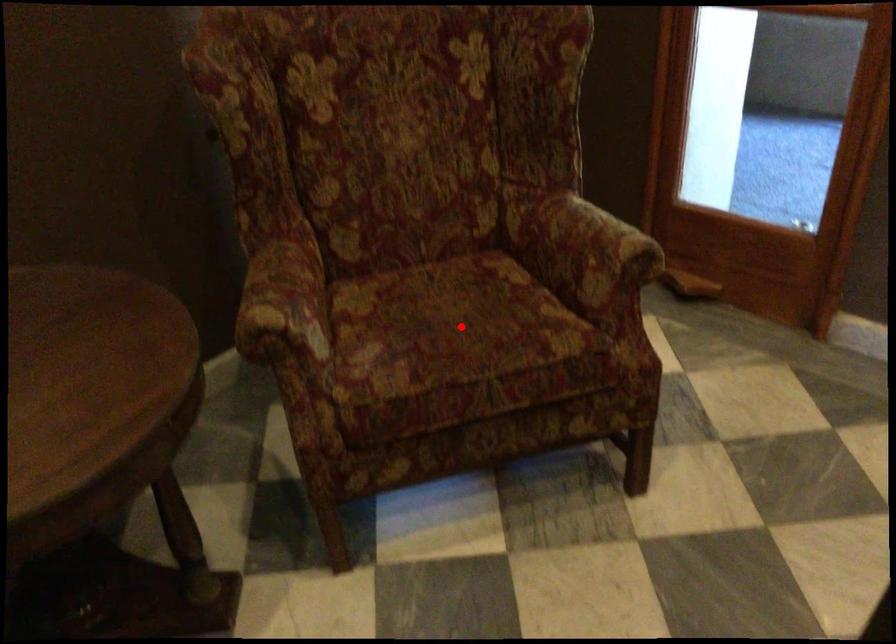
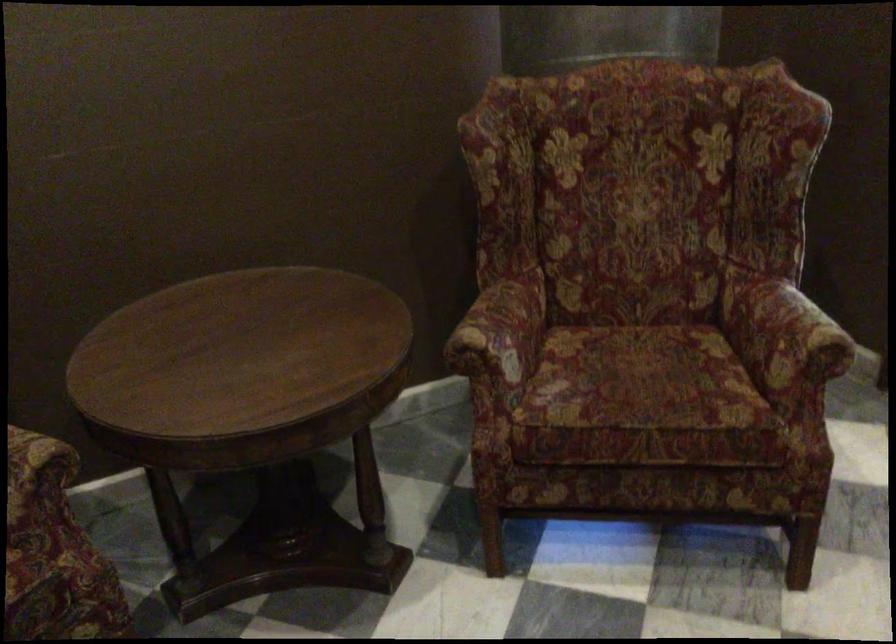
In the second image, find the point that corresponds to the highlighted location in the first image.

(642, 381)